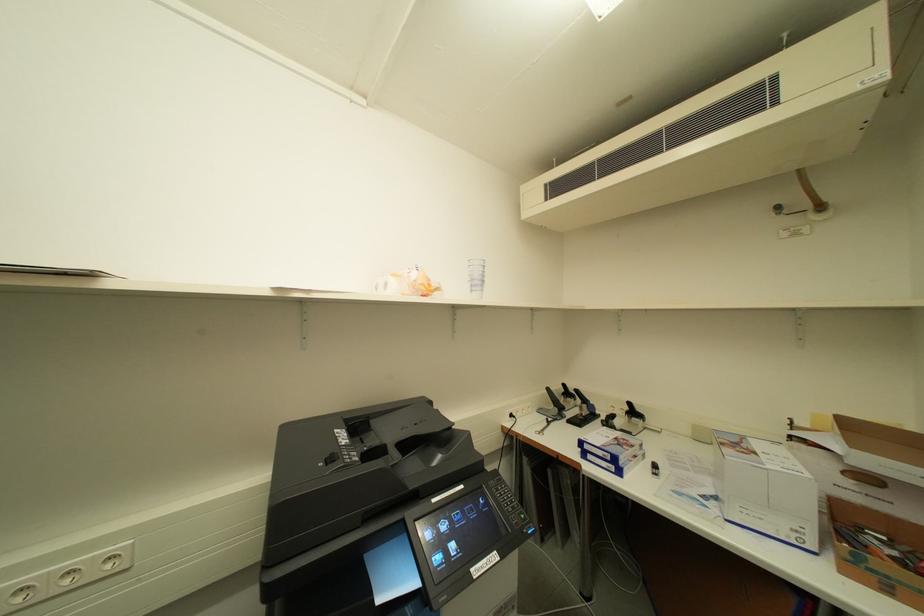
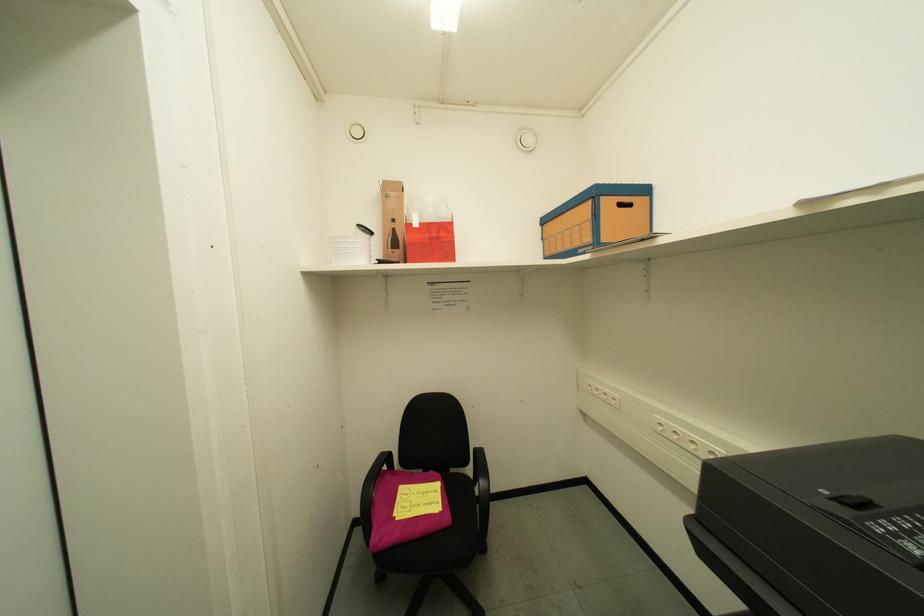
Question: How did the camera likely rotate?

Choices:
 (A) Left
 (B) Right
 (C) Up
 (D) Down

Answer: (A)